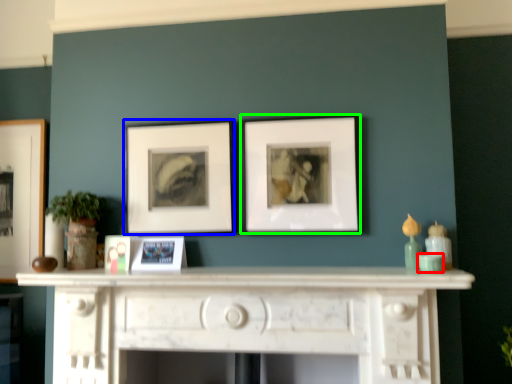
Question: Estimate the real-world distances between objects in this image. Which object is closer to teal (highlighted by a red box), picture frame (highlighted by a blue box) or picture frame (highlighted by a green box)?

Choices:
 (A) picture frame
 (B) picture frame

Answer: (B)